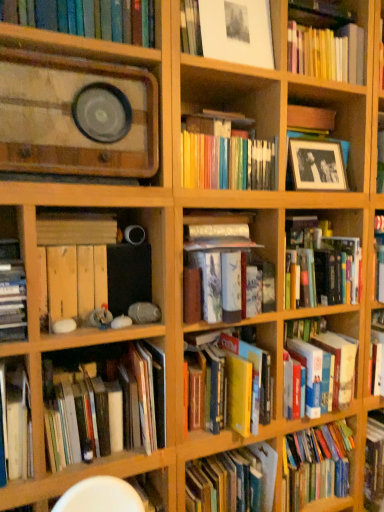
Question: Is matte white framed picture at upper center, the 11th book when ordered from bottom to top, situated inside wooden crate at center-left, the seventh book viewed from the top, or outside?

Choices:
 (A) outside
 (B) inside

Answer: (A)

Question: Considering their positions, is matte white framed picture at upper center, the 11th book when ordered from bottom to top, located in front of or behind wooden crate at center-left, placed as the fifth book when sorted from bottom to top?

Choices:
 (A) front
 (B) behind

Answer: (B)

Question: Estimate the real-world distances between objects in this image. Which object is farther from the hardcover book at center-right, which ranks as the third book in bottom-to-top order?

Choices:
 (A) wooden crate at center-left, the seventh book viewed from the top
 (B) matte white framed picture at upper center, the 11th book when ordered from bottom to top
 (C) hardcover book at center, positioned as the 7th book in bottom-to-top order
 (D) wooden crate at lower left, the fourth book when ordered from top to bottom
 (E) hardcover books at lower left, acting as the 1th book starting from the bottom

Answer: (B)

Question: Which object is the farthest from the hardcover book at center, which appears as the fifth book when viewed from the top?

Choices:
 (A) hardcover books at lower left, placed as the 11th book when sorted from top to bottom
 (B) hardcover book at center, which is the 10th book in top-to-bottom order
 (C) hardcover book at left, which is counted as the 6th book, starting from the bottom
 (D) wooden radio at upper left, positioned as the second book in top-to-bottom order
 (E) hardcover book at center, the fourth book from the bottom

Answer: (C)